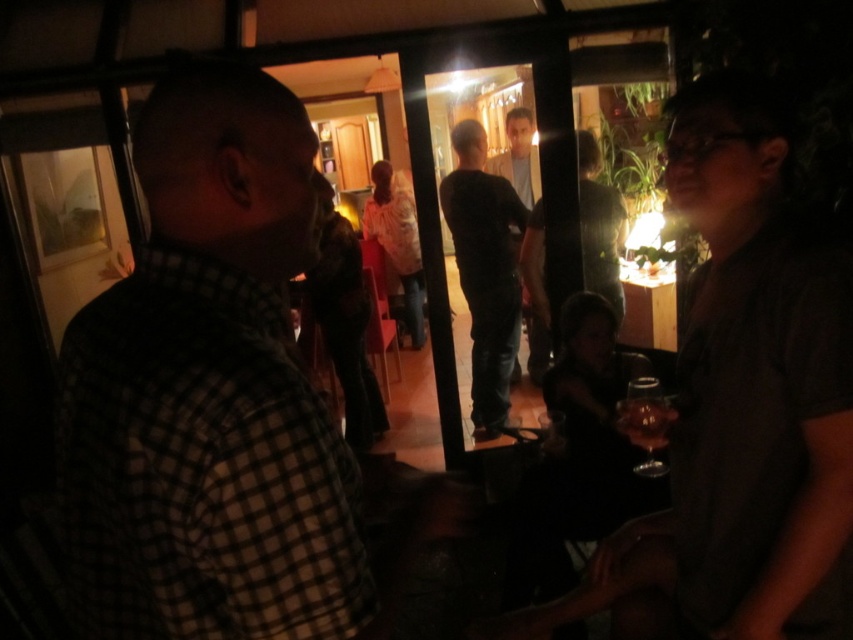
Consider the image. Is dark gray jeans at center positioned in front of dark gray shirt at center?

That is False.

Does dark gray jeans at center appear on the left side of dark gray shirt at center?

Yes, dark gray jeans at center is to the left of dark gray shirt at center.

Is point (509, 196) less distant than point (614, 259)?

That is False.

Find the location of a particular element. dark gray jeans at center is located at coordinates (485, 269).

Can you confirm if checkered fabric shirt at left is thinner than dark gray shirt at center?

Correct, checkered fabric shirt at left's width is less than dark gray shirt at center's.

Is checkered fabric shirt at left closer to the viewer compared to dark gray shirt at center?

Yes, checkered fabric shirt at left is closer to the viewer.

Which is behind, point (264, 486) or point (585, 214)?

The point (585, 214) is behind.

Locate an element on the screen. The height and width of the screenshot is (640, 853). checkered fabric shirt at left is located at coordinates (207, 394).

Does checkered fabric shirt at left appear over white textured sweater at center?

Actually, checkered fabric shirt at left is below white textured sweater at center.

Is checkered fabric shirt at left bigger than white textured sweater at center?

Actually, checkered fabric shirt at left might be smaller than white textured sweater at center.

This screenshot has width=853, height=640. I want to click on checkered fabric shirt at left, so click(207, 394).